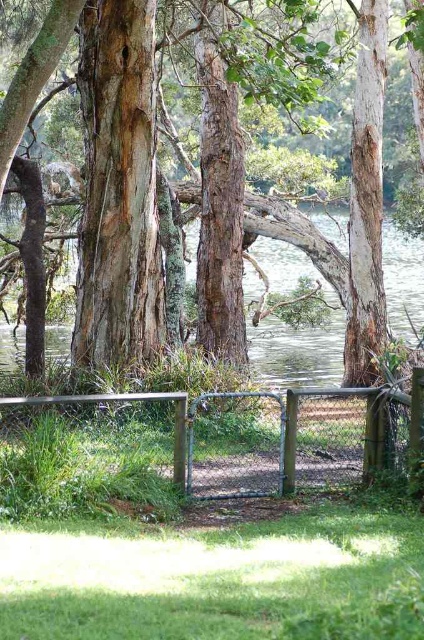
Question: Is clear water at center wider than metallic silver bench at lower center?

Choices:
 (A) yes
 (B) no

Answer: (A)

Question: Where is rough bark tree at center located in relation to clear water at center in the image?

Choices:
 (A) right
 (B) left

Answer: (B)

Question: Which of the following is the farthest from the observer?

Choices:
 (A) pos(423,260)
 (B) pos(166,394)

Answer: (A)

Question: Which point is farther to the camera?

Choices:
 (A) clear water at center
 (B) metallic silver bench at lower center

Answer: (A)

Question: From the image, what is the correct spatial relationship of rough bark tree at center in relation to metallic silver bench at lower center?

Choices:
 (A) below
 (B) above

Answer: (B)

Question: Which of the following is the closest to the observer?

Choices:
 (A) (335, 216)
 (B) (357, 115)

Answer: (B)